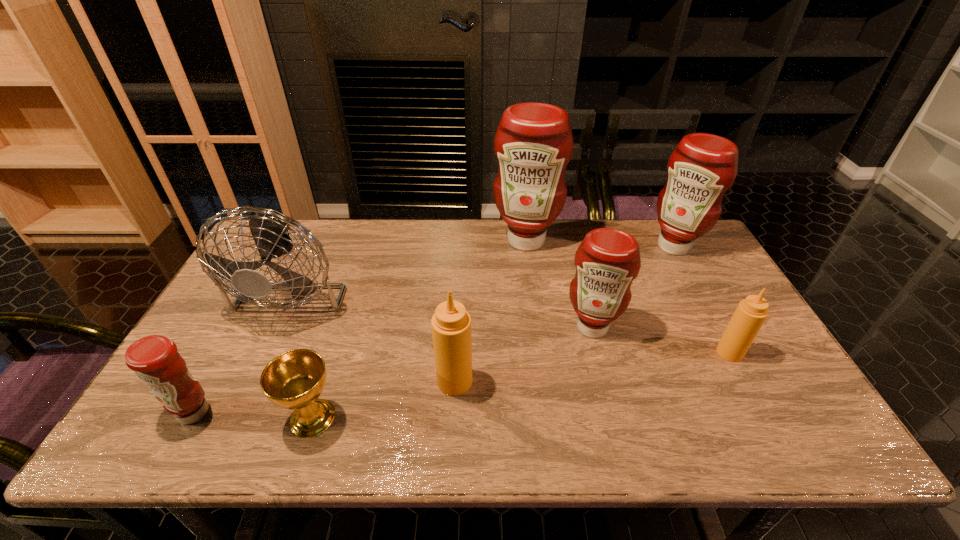
Locate an element on the screen. object that is at the far right corner is located at coordinates (701, 169).

Where is `free space at the far edge`? The height and width of the screenshot is (540, 960). free space at the far edge is located at coordinates [474, 241].

Locate an element on the screen. The image size is (960, 540). free spot at the right edge of the desktop is located at coordinates (803, 400).

Where is `free space between the nearer tan condiment and the fan`? This screenshot has width=960, height=540. free space between the nearer tan condiment and the fan is located at coordinates (377, 332).

What are the coordinates of `empty space that is in between the third farthest red condiment and the nearer tan condiment` in the screenshot? It's located at (523, 354).

Identify the location of free spot between the chalice and the smaller tan condiment. The width and height of the screenshot is (960, 540). (521, 385).

Where is `vacant space that's between the tallest object and the leftmost condiment`? vacant space that's between the tallest object and the leftmost condiment is located at coordinates (360, 326).

I want to click on vacant point located between the smaller tan condiment and the fan, so click(515, 317).

Identify the location of vacant space that's between the shortest object and the leftmost condiment. This screenshot has height=540, width=960. (253, 415).

Locate an element on the screen. This screenshot has width=960, height=540. free spot between the second condiment from left to right and the fifth shortest condiment is located at coordinates (564, 314).